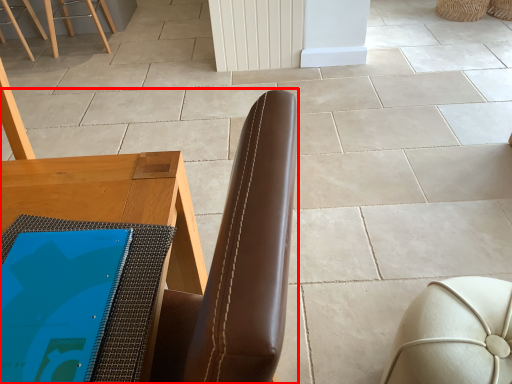
Question: Where is chair (annotated by the red box) located in relation to furniture in the image?

Choices:
 (A) left
 (B) right

Answer: (A)